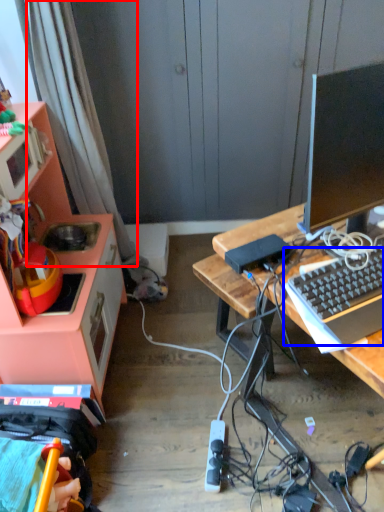
Question: Which of the following is the closest to the observer, curtain (highlighted by a red box) or computer keyboard (highlighted by a blue box)?

Choices:
 (A) curtain
 (B) computer keyboard

Answer: (B)